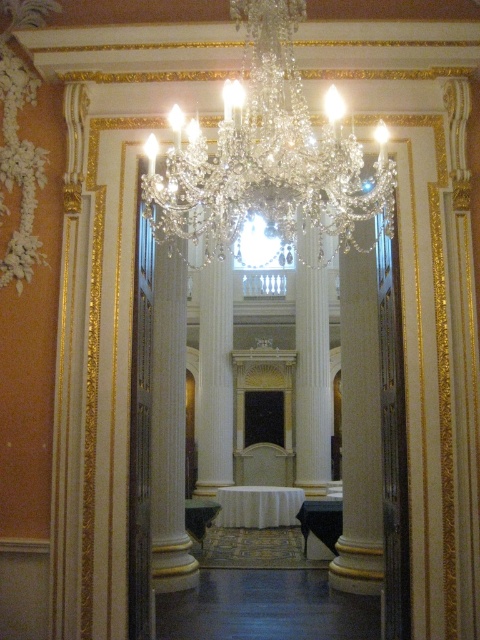
Is crystal clear chandelier at center to the left of white marble pillar at center from the viewer's perspective?

Yes, crystal clear chandelier at center is to the left of white marble pillar at center.

Does crystal clear chandelier at center appear on the right side of white marble pillar at center?

Incorrect, crystal clear chandelier at center is not on the right side of white marble pillar at center.

Is point (265, 172) positioned behind point (322, 426)?

No, (265, 172) is closer to viewer.

This screenshot has height=640, width=480. Find the location of `crystal clear chandelier at center`. crystal clear chandelier at center is located at coordinates (x=265, y=154).